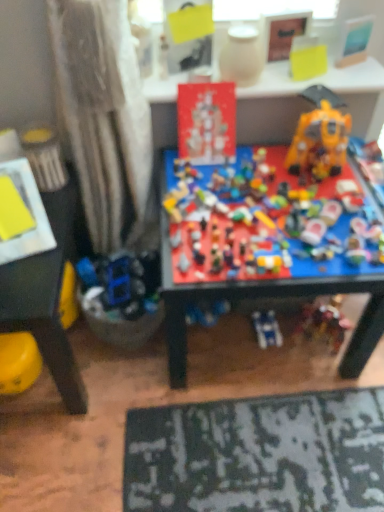
Describe the element at coordinates (304, 100) in the screenshot. This screenshot has width=384, height=512. I see `red cardboard sign at upper center, the 2th table from the left` at that location.

Where is `metallic yellow can at left, which is counted as the 1th toy, starting from the left`? Image resolution: width=384 pixels, height=512 pixels. metallic yellow can at left, which is counted as the 1th toy, starting from the left is located at coordinates (44, 157).

Describe the element at coordinates (46, 298) in the screenshot. I see `yellow plastic toy at lower left, which appears as the first table when ordered from the bottom` at that location.

This screenshot has height=512, width=384. Describe the element at coordinates (102, 116) in the screenshot. I see `matte white curtain at left` at that location.

I want to click on shiny yellow plastic robot at upper right, acting as the sixth toy starting from the left, so click(319, 138).

From a real-world perspective, who is located lower, yellow matte paper at upper center, positioned as the 5th toy in left-to-right order, or yellow plastic toy at lower left, arranged as the 2th table when viewed from the top?

yellow plastic toy at lower left, arranged as the 2th table when viewed from the top, from a real-world perspective.

Between yellow matte paper at upper center, positioned as the 5th toy in left-to-right order, and yellow plastic toy at lower left, which appears as the first table when ordered from the bottom, which one has larger width?

With larger width is yellow plastic toy at lower left, which appears as the first table when ordered from the bottom.

How many degrees apart are the facing directions of yellow matte paper at upper center, placed as the second toy when sorted from right to left, and yellow plastic toy at lower left, arranged as the 2th table when viewed from the top?

28.6 degrees.

Is yellow matte paper at upper center, placed as the second toy when sorted from right to left, inside or outside of yellow plastic toy at lower left, arranged as the 2th table when viewed from the top?

The correct answer is: outside.

Does yellow matte paper at upper center, positioned as the 5th toy in left-to-right order, have a greater width compared to red cardboard sign at upper center, which ranks as the second table in bottom-to-top order?

Incorrect, the width of yellow matte paper at upper center, positioned as the 5th toy in left-to-right order, does not surpass that of red cardboard sign at upper center, which ranks as the second table in bottom-to-top order.

Based on their sizes in the image, would you say yellow matte paper at upper center, positioned as the 5th toy in left-to-right order, is bigger or smaller than red cardboard sign at upper center, which ranks as the second table in bottom-to-top order?

Considering their sizes, yellow matte paper at upper center, positioned as the 5th toy in left-to-right order, takes up less space than red cardboard sign at upper center, which ranks as the second table in bottom-to-top order.

From the image's perspective, which toy is the 2nd one above the red cardboard sign at upper center, the 2th table from the left? Please provide its 2D coordinates.

[(307, 57)]

From a real-world perspective, between shiny yellow plastic robot at upper right, the 1th toy positioned from the right, and multicolored plastic toys at center, the 3th toy viewed from the right, who is vertically lower?

multicolored plastic toys at center, the 3th toy viewed from the right.

Can you confirm if shiny yellow plastic robot at upper right, the 1th toy positioned from the right, is taller than multicolored plastic toys at center, which appears as the fourth toy when viewed from the left?

Yes, shiny yellow plastic robot at upper right, the 1th toy positioned from the right, is taller than multicolored plastic toys at center, which appears as the fourth toy when viewed from the left.

Which of these two, shiny yellow plastic robot at upper right, acting as the sixth toy starting from the left, or multicolored plastic toys at center, the 3th toy viewed from the right, is bigger?

multicolored plastic toys at center, the 3th toy viewed from the right, is bigger.

From the image's perspective, which object appears higher, shiny yellow plastic robot at upper right, the 1th toy positioned from the right, or multicolored plastic toys at center, which appears as the fourth toy when viewed from the left?

shiny yellow plastic robot at upper right, the 1th toy positioned from the right, appears higher in the image.

Considering the relative positions of metallic yellow can at left, the 6th toy viewed from the right, and multicolored plastic toys at center, the 3th toy viewed from the right, in the image provided, is metallic yellow can at left, the 6th toy viewed from the right, to the left or to the right of multicolored plastic toys at center, the 3th toy viewed from the right,?

metallic yellow can at left, the 6th toy viewed from the right, is to the left of multicolored plastic toys at center, the 3th toy viewed from the right.

Where is `toy that is the 2nd object located behind the multicolored plastic toys at center, the 3th toy viewed from the right`? Image resolution: width=384 pixels, height=512 pixels. toy that is the 2nd object located behind the multicolored plastic toys at center, the 3th toy viewed from the right is located at coordinates (44, 157).

Which of these two, metallic yellow can at left, which is counted as the 1th toy, starting from the left, or multicolored plastic toys at center, the 3th toy viewed from the right, is bigger?

Bigger between the two is multicolored plastic toys at center, the 3th toy viewed from the right.

Which point is more distant from viewer, (43, 174) or (245, 177)?

Point (43, 174)

Is matte white curtain at left taller than yellow plastic toy at lower left, which is the first table from left to right?

Yes.

Would you say matte white curtain at left contains yellow plastic toy at lower left, which appears as the first table when ordered from the bottom?

No, yellow plastic toy at lower left, which appears as the first table when ordered from the bottom, is not inside matte white curtain at left.

From a real-world perspective, is matte white curtain at left over yellow plastic toy at lower left, which is the first table from left to right?

Yes.

Between matte white curtain at left and yellow plastic toy at lower left, which is the 2th table in right-to-left order, which one has larger width?

yellow plastic toy at lower left, which is the 2th table in right-to-left order.

Is point (307, 61) farther from camera compared to point (299, 147)?

Yes.

From the image's perspective, is yellow matte paper at upper center, placed as the second toy when sorted from right to left, under shiny yellow plastic robot at upper right, the 1th toy positioned from the right?

No.

From the image's perspective, count 3rd toys downward from the yellow matte paper at upper center, placed as the second toy when sorted from right to left, and point to it. Please provide its 2D coordinates.

[(319, 138)]

From the picture: Is yellow matte paper at upper center, placed as the second toy when sorted from right to left, situated inside shiny yellow plastic robot at upper right, acting as the sixth toy starting from the left, or outside?

yellow matte paper at upper center, placed as the second toy when sorted from right to left, cannot be found inside shiny yellow plastic robot at upper right, acting as the sixth toy starting from the left.

Can you confirm if red cardboard sign at upper center, which is the 1th table from right to left, is positioned to the left of multicolored plastic toys at center, which appears as the fourth toy when viewed from the left?

No, red cardboard sign at upper center, which is the 1th table from right to left, is not to the left of multicolored plastic toys at center, which appears as the fourth toy when viewed from the left.

Measure the distance between red cardboard sign at upper center, the 1th table in the top-to-bottom sequence, and multicolored plastic toys at center, the 3th toy viewed from the right.

The distance of red cardboard sign at upper center, the 1th table in the top-to-bottom sequence, from multicolored plastic toys at center, the 3th toy viewed from the right, is 12.03 inches.

Is red cardboard sign at upper center, which ranks as the second table in bottom-to-top order, facing towards multicolored plastic toys at center, which appears as the fourth toy when viewed from the left?

No, red cardboard sign at upper center, which ranks as the second table in bottom-to-top order, does not turn towards multicolored plastic toys at center, which appears as the fourth toy when viewed from the left.

This screenshot has height=512, width=384. I want to click on the 6th toy behind when counting from the yellow plastic toy at lower left, arranged as the 2th table when viewed from the top, so click(x=307, y=57).

Locate an element on the screen. This screenshot has height=512, width=384. the 1st toy in front of the red cardboard sign at upper center, the 1th table in the top-to-bottom sequence is located at coordinates (307, 57).

Considering their positions, is yellow plastic toy at lower left, which appears as the first table when ordered from the bottom, positioned further to multicolored plastic toys at center, which appears as the fourth toy when viewed from the left, than red cardboard sign at upper center, the 1th table in the top-to-bottom sequence?

Among the two, yellow plastic toy at lower left, which appears as the first table when ordered from the bottom, is located further to multicolored plastic toys at center, which appears as the fourth toy when viewed from the left.

Estimate the real-world distances between objects in this image. Which object is further from yellow matte paper at upper center, placed as the second toy when sorted from right to left, metallic yellow can at left, the 6th toy viewed from the right, or matte white vase at upper center, placed as the 3th toy when sorted from left to right?

metallic yellow can at left, the 6th toy viewed from the right, lies further to yellow matte paper at upper center, placed as the second toy when sorted from right to left, than the other object.

Considering their positions, is matte white vase at upper center, the 4th toy positioned from the right, positioned closer to metallic yellow can at left, which is counted as the 1th toy, starting from the left, than matte red poster at center, marked as the 2th toy in a left-to-right arrangement?

matte red poster at center, marked as the 2th toy in a left-to-right arrangement, is positioned closer to the anchor metallic yellow can at left, which is counted as the 1th toy, starting from the left.

Looking at the image, which one is located further to red cardboard sign at upper center, which ranks as the second table in bottom-to-top order, matte white curtain at left or matte red poster at center, marked as the 2th toy in a left-to-right arrangement?

matte white curtain at left is further to red cardboard sign at upper center, which ranks as the second table in bottom-to-top order.

Which object lies further to the anchor point yellow matte paper at upper center, placed as the second toy when sorted from right to left, shiny yellow plastic robot at upper right, acting as the sixth toy starting from the left, or matte white vase at upper center, placed as the 3th toy when sorted from left to right?

The object further to yellow matte paper at upper center, placed as the second toy when sorted from right to left, is shiny yellow plastic robot at upper right, acting as the sixth toy starting from the left.

Based on their spatial positions, is matte white curtain at left or multicolored plastic toys at center, the 3th toy viewed from the right, closer to red cardboard sign at upper center, the 1th table in the top-to-bottom sequence?

Among the two, matte white curtain at left is located nearer to red cardboard sign at upper center, the 1th table in the top-to-bottom sequence.

Which object lies further to the anchor point red cardboard sign at upper center, which ranks as the second table in bottom-to-top order, matte white vase at upper center, the 4th toy positioned from the right, or shiny yellow plastic robot at upper right, the 1th toy positioned from the right?

Based on the image, shiny yellow plastic robot at upper right, the 1th toy positioned from the right, appears to be further to red cardboard sign at upper center, which ranks as the second table in bottom-to-top order.

In the scene shown: Estimate the real-world distances between objects in this image. Which object is closer to metallic yellow can at left, the 6th toy viewed from the right, yellow plastic toy at lower left, arranged as the 2th table when viewed from the top, or multicolored plastic toys at center, which appears as the fourth toy when viewed from the left?

yellow plastic toy at lower left, arranged as the 2th table when viewed from the top.

You are a GUI agent. You are given a task and a screenshot of the screen. Output one action in this format:
    pyautogui.click(x=<x>, y=<y>)
    Task: Click on the curtain between yellow plastic toy at lower left, which is the 2th table in right-to-left order, and matte red poster at center, the fifth toy in the right-to-left sequence, from left to right
    Image resolution: width=384 pixels, height=512 pixels.
    Given the screenshot: What is the action you would take?
    pyautogui.click(x=102, y=116)

The width and height of the screenshot is (384, 512). Identify the location of table between metallic yellow can at left, which is counted as the 1th toy, starting from the left, and shiny yellow plastic robot at upper right, the 1th toy positioned from the right. (304, 100).

Locate an element on the screen. table between matte red poster at center, marked as the 2th toy in a left-to-right arrangement, and yellow matte paper at upper center, positioned as the 5th toy in left-to-right order, from left to right is located at coordinates (304, 100).

Locate an element on the screen. The width and height of the screenshot is (384, 512). curtain between metallic yellow can at left, which is counted as the 1th toy, starting from the left, and matte red poster at center, marked as the 2th toy in a left-to-right arrangement, from left to right is located at coordinates (102, 116).